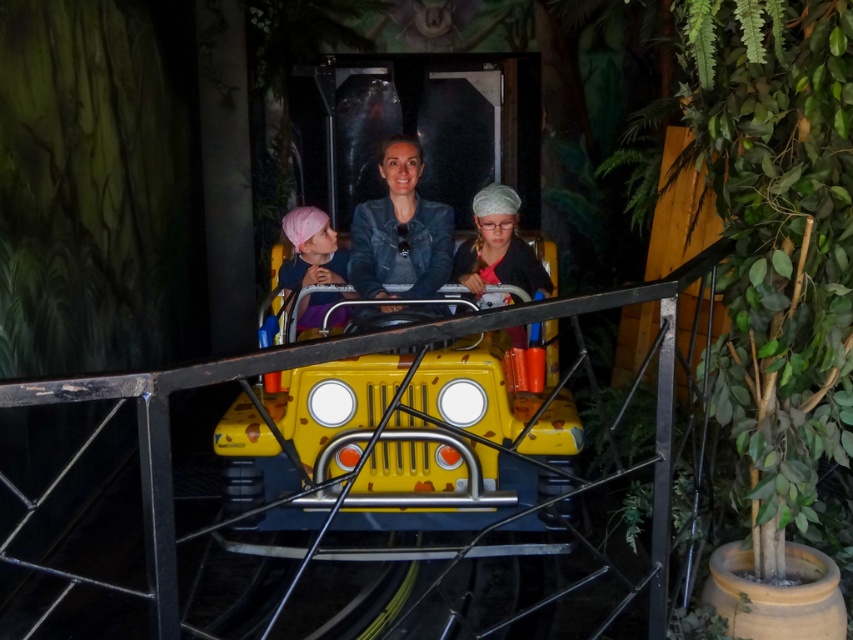
Question: Does matte black car at center have a smaller size compared to pink fabric headband at left?

Choices:
 (A) no
 (B) yes

Answer: (A)

Question: Which point is closer to the camera?

Choices:
 (A) denim jacket at center
 (B) matte black car at center
 (C) pink fabric headband at left

Answer: (A)

Question: Is denim jacket at center above pink fabric headband at left?

Choices:
 (A) yes
 (B) no

Answer: (A)

Question: Which point is closer to the camera taking this photo?

Choices:
 (A) (322, 280)
 (B) (309, 230)

Answer: (A)

Question: Which of the following is the farthest from the observer?

Choices:
 (A) denim jacket at center
 (B) pink fabric headband at left

Answer: (B)

Question: From the image, what is the correct spatial relationship of matte black car at center in relation to denim jacket at center?

Choices:
 (A) above
 (B) below

Answer: (B)